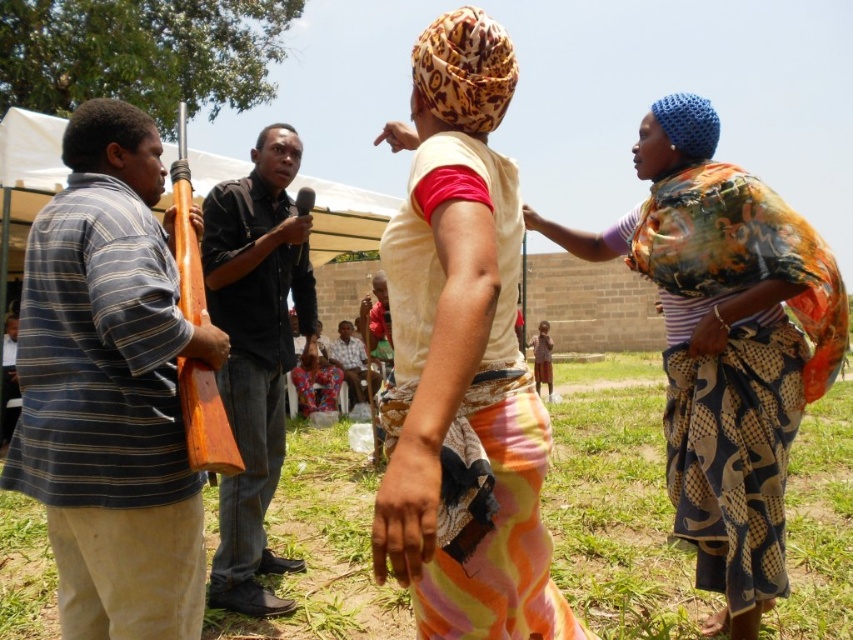
You are a photographer standing at the camera position. You want to take a photo that includes both point [769,531] and point [370,326]. Which point will appear larger in the photo?

Point [769,531] is closer to the camera than point [370,326], so it will appear larger in the photo.

You are a photographer positioned at the center of the scene. You want to capture a photo that includes both the wooden rifle at left and the microphone holder. To ensure the rifle is not blocking the microphone holder, where should you position yourself relative to the rifle?

Since the wooden rifle at left is located at point [111,388], positioning yourself to the right side of the rifle would keep it from blocking the microphone holder.

Based on the coordinates provided, which object is located at point (462, 362) in the image?

The point (462, 362) corresponds to the matte yellow shirt at center.